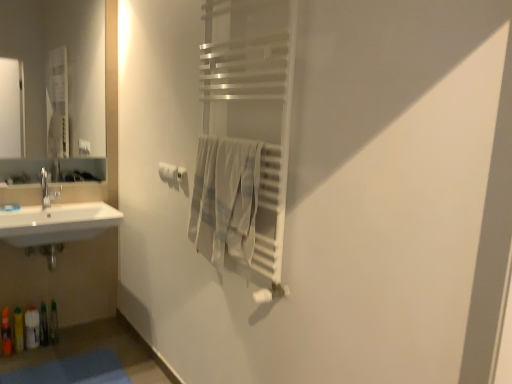
The width and height of the screenshot is (512, 384). I want to click on vacant area that is situated to the right of translucent plastic bottles at lower left, the fourth toiletry viewed from the left, so click(x=79, y=341).